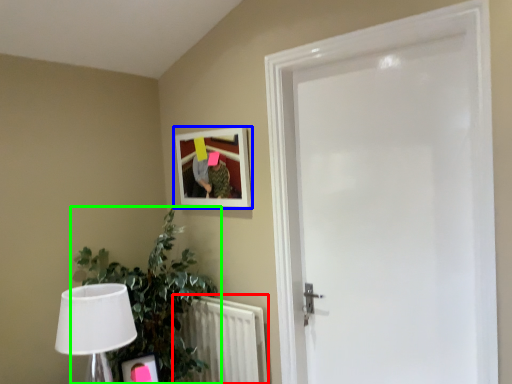
Question: Estimate the real-world distances between objects in this image. Which object is closer to radiator (highlighted by a red box), picture frame (highlighted by a blue box) or houseplant (highlighted by a green box)?

Choices:
 (A) picture frame
 (B) houseplant

Answer: (B)